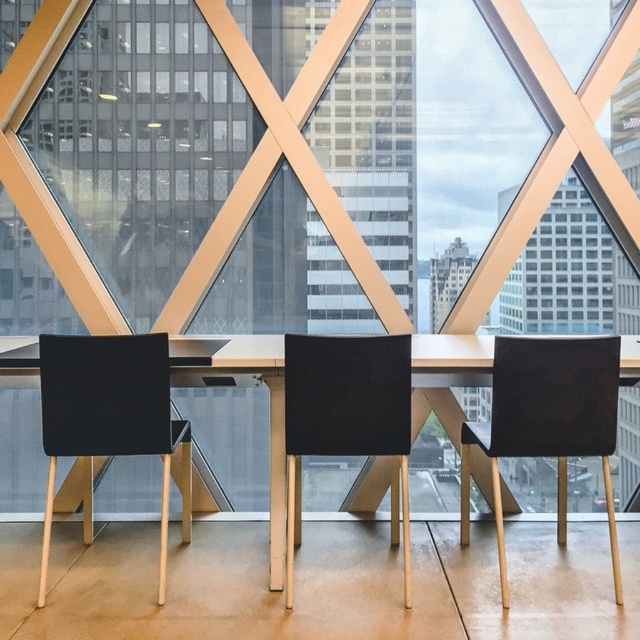
Can you confirm if matte black chair at left is positioned above black leather chair at center?

No.

Which is above, matte black chair at left or black leather chair at center?

black leather chair at center

Which is in front, point (134, 365) or point (340, 349)?

Point (340, 349) is in front.

Identify the location of matte black chair at left. The image size is (640, 640). (108, 413).

Where is `matte black chair at left`? matte black chair at left is located at coordinates (108, 413).

Does matte black chair at left have a smaller size compared to metallic gold table at center?

Yes, matte black chair at left is smaller than metallic gold table at center.

Find the location of a particular element. matte black chair at left is located at coordinates (108, 413).

Who is more forward, (x=518, y=406) or (x=380, y=371)?

Point (x=380, y=371) is more forward.

Find the location of `black fabric chair at right`. black fabric chair at right is located at coordinates (547, 422).